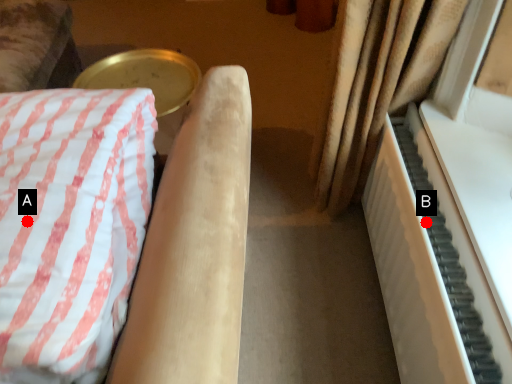
Question: Two points are circled on the image, labeled by A and B beside each circle. Which point is farther from the camera taking this photo?

Choices:
 (A) A is further
 (B) B is further

Answer: (B)